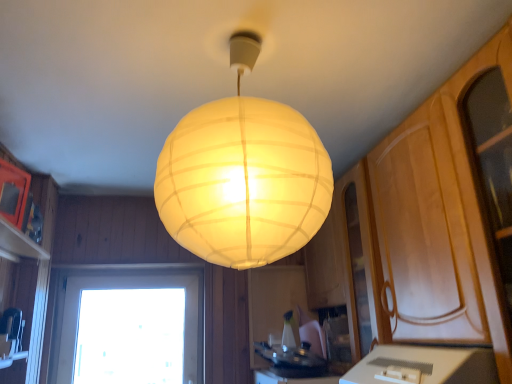
Question: Considering their positions, is white paper lampshade at center located in front of or behind white glossy countertop at lower center?

Choices:
 (A) behind
 (B) front

Answer: (B)

Question: From the image's perspective, is white paper lampshade at center positioned above or below white glossy countertop at lower center?

Choices:
 (A) above
 (B) below

Answer: (A)

Question: Which of these objects is positioned farthest from the white glossy countertop at lower center?

Choices:
 (A) transparent glass window at lower left
 (B) white paper lampshade at center

Answer: (A)

Question: Based on their relative distances, which object is nearer to the white glossy countertop at lower center?

Choices:
 (A) transparent glass window at lower left
 (B) white paper lampshade at center

Answer: (B)